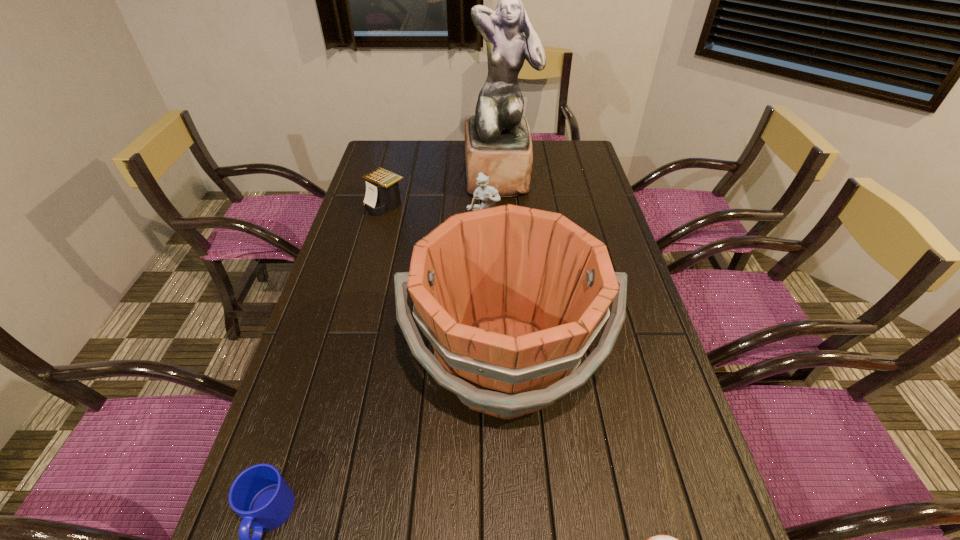
You are a GUI agent. You are given a task and a screenshot of the screen. Output one action in this format:
    pyautogui.click(x=<x>, y=<y>)
    Task: Click on the free area in between the calculator and the tallest object
    
    Given the screenshot: What is the action you would take?
    pyautogui.click(x=443, y=191)

Point out which object is positioned as the third nearest to the third tallest object. Please provide its 2D coordinates. Your answer should be formatted as a tuple, i.e. [(x, y)], where the tuple contains the x and y coordinates of a point satisfying the conditions above.

[(382, 195)]

Find the location of `object that can be found as the fifth closest to the second tallest object`. object that can be found as the fifth closest to the second tallest object is located at coordinates (498, 143).